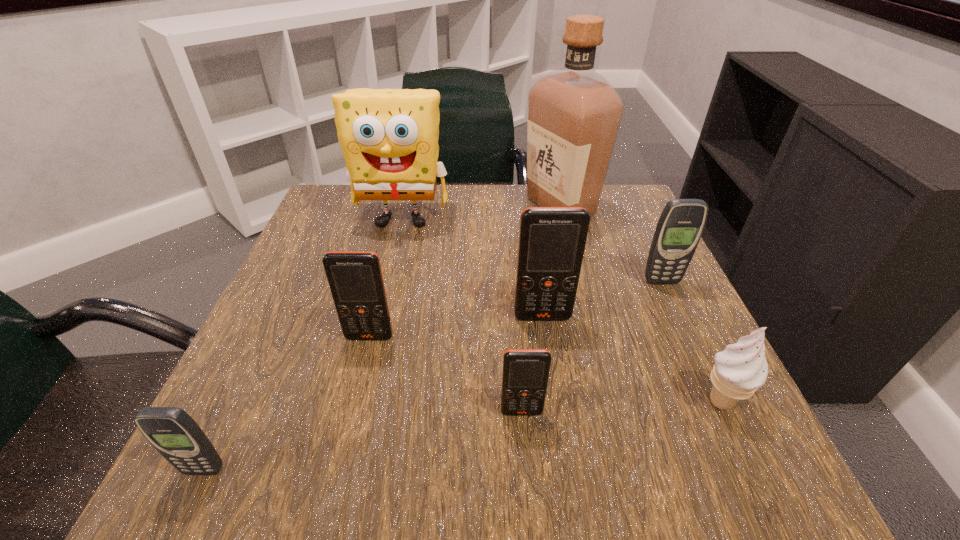
Locate an element on the screen. This screenshot has height=540, width=960. vacant space located 0.260m on the screen of the farthest cellular telephone is located at coordinates (718, 403).

Identify the location of vacant space situated on the screen of the fifth farthest object. (336, 472).

You are a GUI agent. You are given a task and a screenshot of the screen. Output one action in this format:
    pyautogui.click(x=<x>, y=<y>)
    Task: Click on the vacant space situated on the front-facing side of the icecream
    This screenshot has width=960, height=540.
    Given the screenshot: What is the action you would take?
    pyautogui.click(x=754, y=471)

Locate an element on the screen. The width and height of the screenshot is (960, 540). blank area located on the screen of the nearest orange cellular telephone is located at coordinates point(526,472).

Locate an element on the screen. The width and height of the screenshot is (960, 540). liquor located in the far edge section of the desktop is located at coordinates (574, 113).

At what (x,y) coordinates should I click in order to perform the action: click on sponge that is at the far edge. Please return your answer as a coordinate pair (x, y). Looking at the image, I should click on (389, 137).

The width and height of the screenshot is (960, 540). What are the coordinates of `object present at the near edge` in the screenshot? It's located at (173, 433).

Where is `sponge that is at the left edge`? This screenshot has width=960, height=540. sponge that is at the left edge is located at coordinates coord(389,137).

Where is `liquor at the right edge`? The image size is (960, 540). liquor at the right edge is located at coordinates (574, 113).

Where is `cellular telephone situated at the right edge`? This screenshot has width=960, height=540. cellular telephone situated at the right edge is located at coordinates (679, 229).